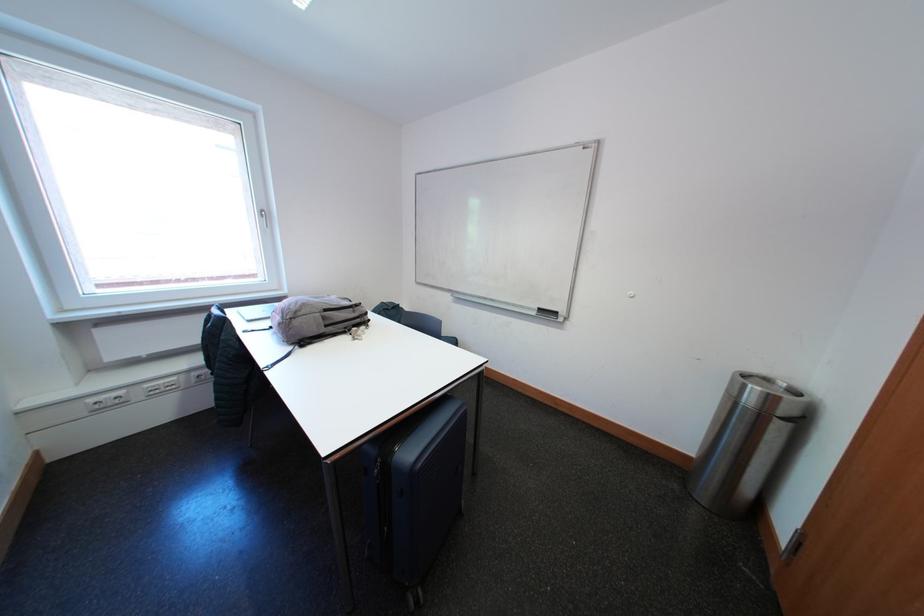
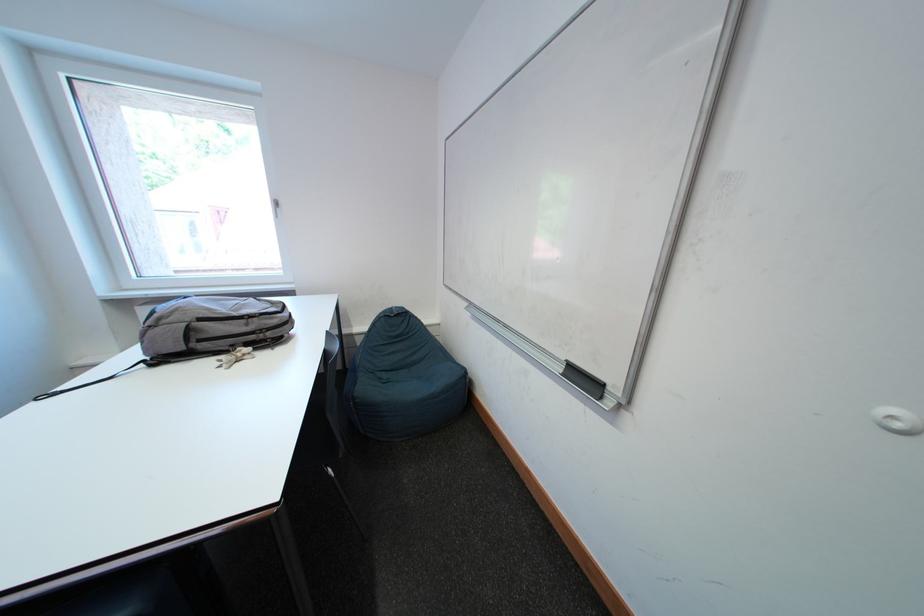
In a continuous first-person perspective shot, in which direction is the camera moving?

The movement direction of the cameraman is right, forward.